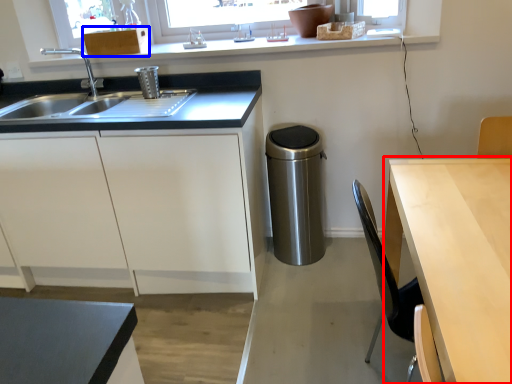
Question: Which object appears closest to the camera in this image, table (highlighted by a red box) or cabinetry (highlighted by a blue box)?

Choices:
 (A) table
 (B) cabinetry

Answer: (A)